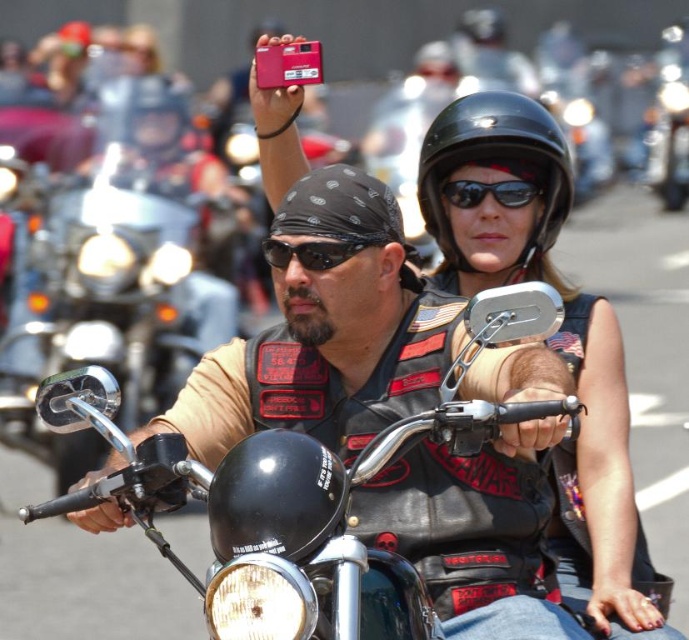
You are a photographer at the motorcycle rally and want to capture the matte black helmet at upper center and the metallic silver motorcycle at center in a single photo. Which object will appear smaller in the photo?

The matte black helmet at upper center is not as tall as the metallic silver motorcycle at center, so the helmet will appear smaller in the photo.

You are a photographer at the motorcycle rally and need to position yourself to capture the black glossy helmet at upper center in the frame. The rally coordinator tells you that the ideal photo spot is at point 0.5 on the x and y axes. Based on the current position of the helmet, should you move left or right, and up or down to align it with the ideal spot?

The black glossy helmet at upper center is located at point 0.258 on the x and 0.720 on the y. To reach the ideal spot at 0.5 on both axes, you should move the helmet to the right by 0.242 on the x and down by 0.280 on the y.

You are a photographer at the motorcycle rally. You want to take a photo of the metallic silver motorcycle at center and the black glossy helmet at upper center. The camera you have can focus on objects up to 70 meters away. Will both objects be in focus?

The black glossy helmet at upper center is 69.75 meters away from the metallic silver motorcycle at center. Since the camera can focus up to 70 meters, both objects are within the focus range and will be in focus.